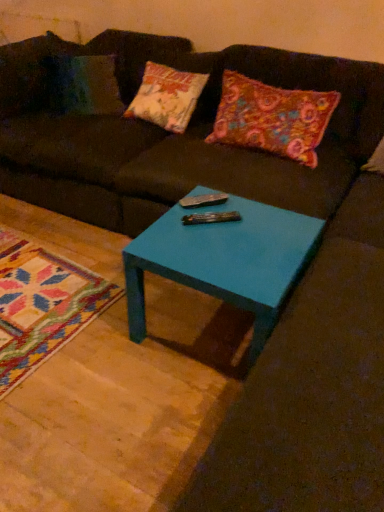
Locate an element on the screen. The image size is (384, 512). vacant region to the left of teal glossy table at center is located at coordinates point(91,353).